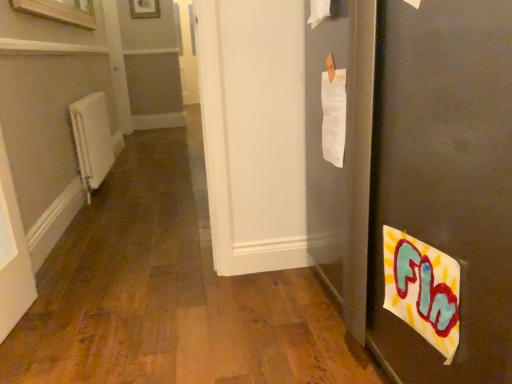
Identify the location of vacant area that lies to the right of white matte radiator at left. (140, 190).